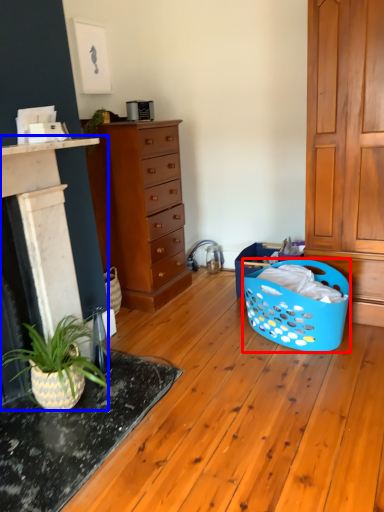
Question: Which object is closer to the camera taking this photo, basket (highlighted by a red box) or fireplace (highlighted by a blue box)?

Choices:
 (A) basket
 (B) fireplace

Answer: (B)